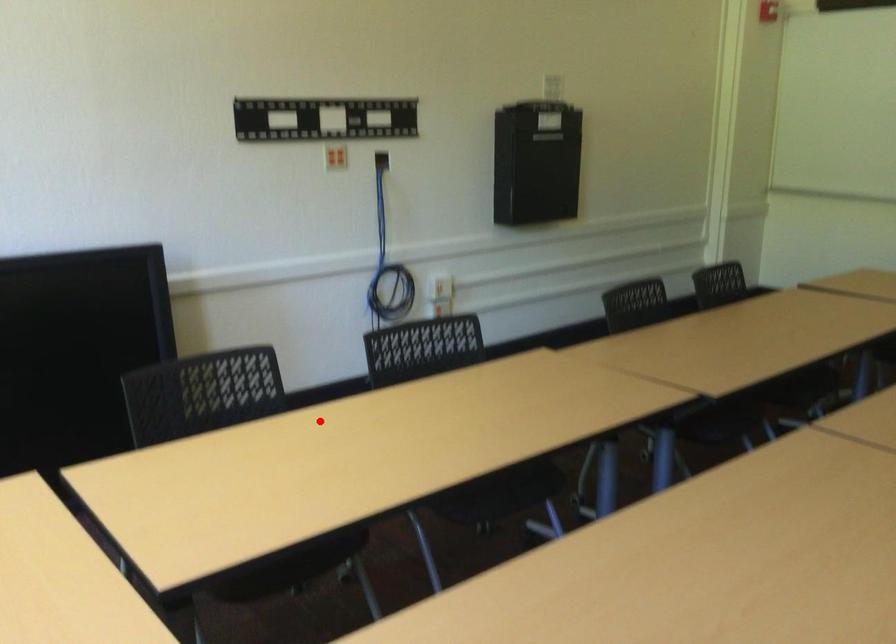
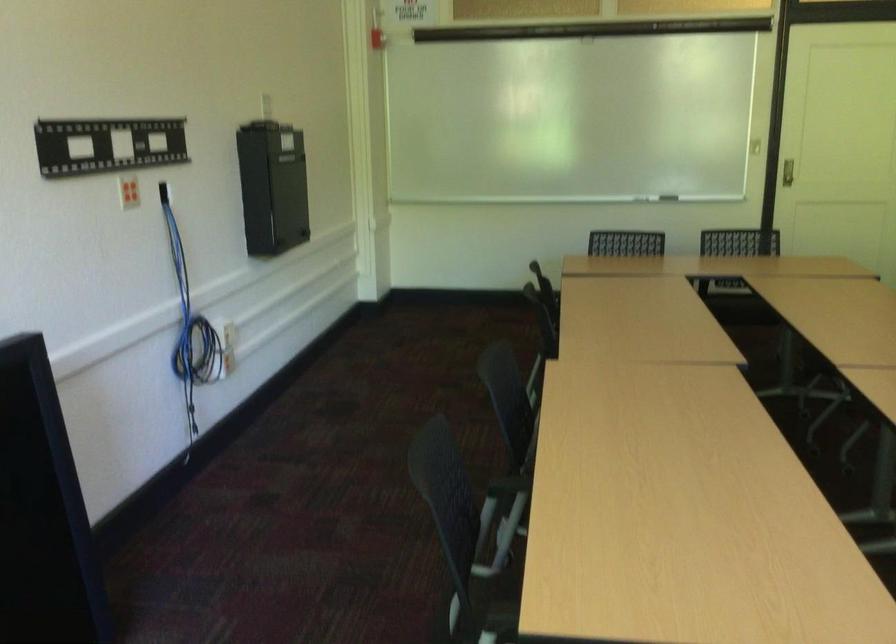
In the second image, find the point that corresponds to the highlighted location in the first image.

(506, 486)